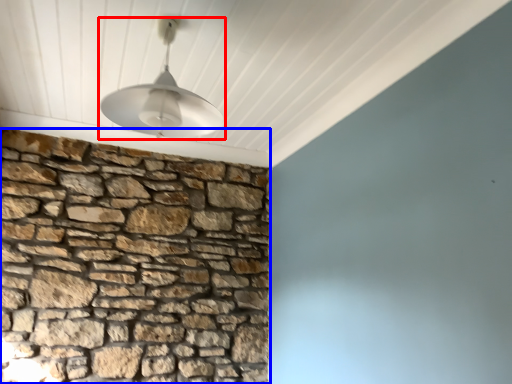
Question: Among these objects, which one is nearest to the camera, lamp (highlighted by a red box) or brickwork (highlighted by a blue box)?

Choices:
 (A) lamp
 (B) brickwork

Answer: (A)